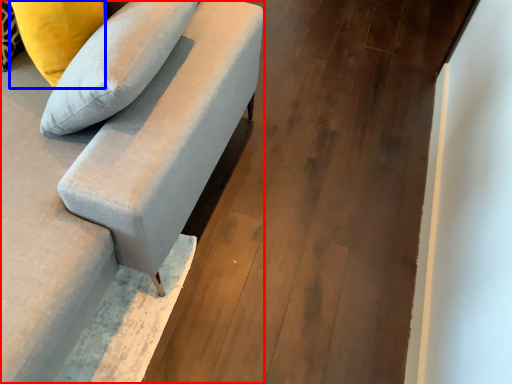
Question: Which of the following is the closest to the observer, studio couch (highlighted by a red box) or pillow (highlighted by a blue box)?

Choices:
 (A) studio couch
 (B) pillow

Answer: (A)